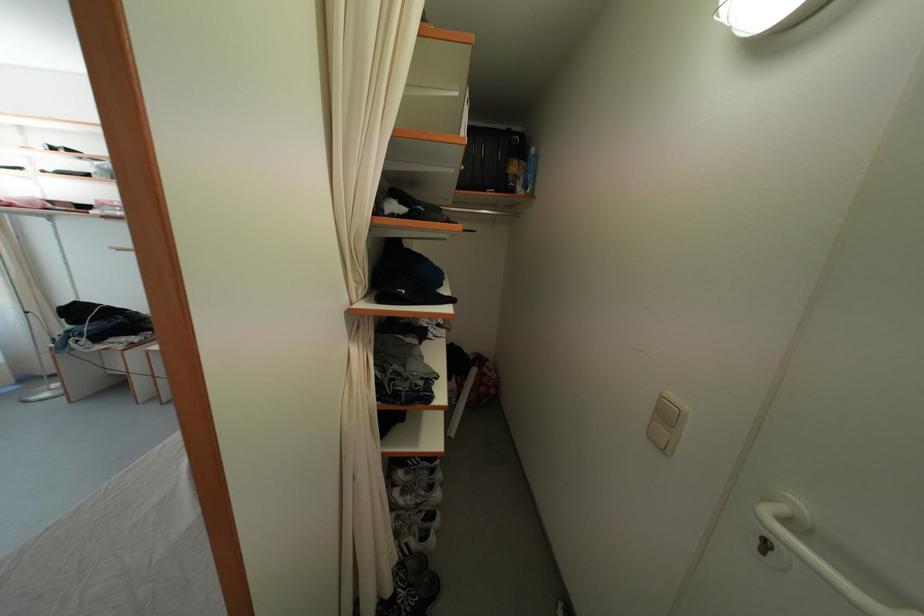
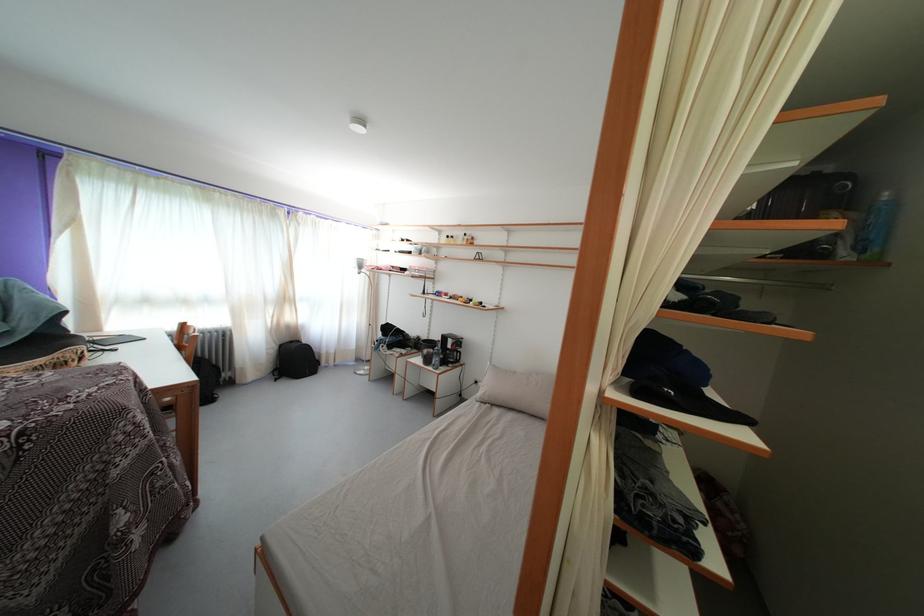
Question: How did the camera likely rotate?

Choices:
 (A) Left
 (B) Right
 (C) Up
 (D) Down

Answer: (A)